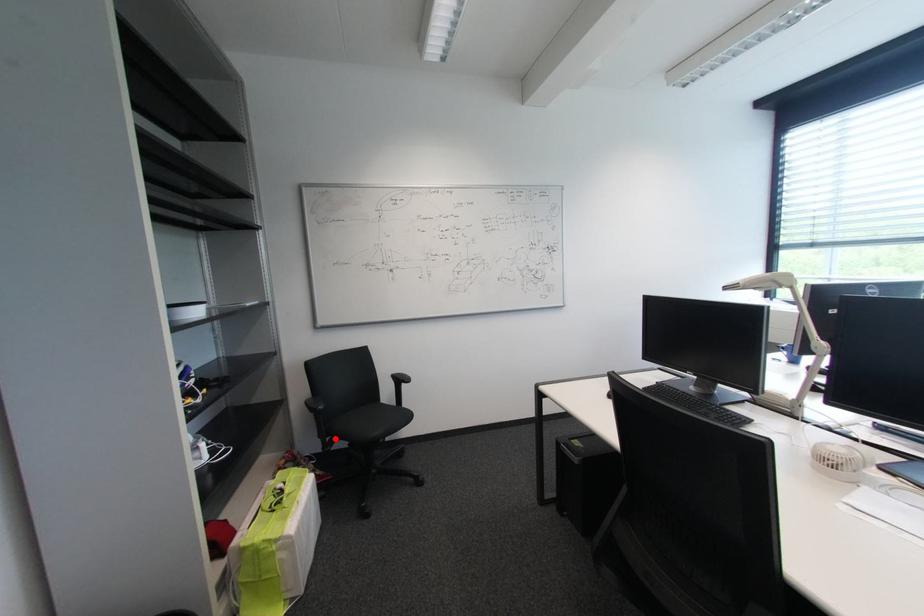
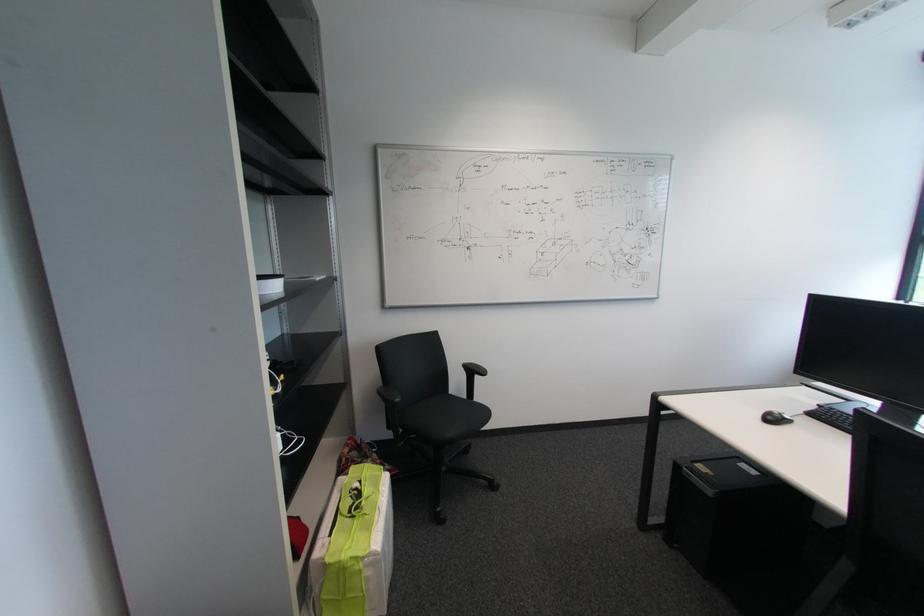
Question: I am providing you with two images of the same scene from different viewpoints. In image1, a red point is highlighted. Considering the same 3D point in image2, which of the following is correct?

Choices:
 (A) It is closer
 (B) It is farther

Answer: (B)